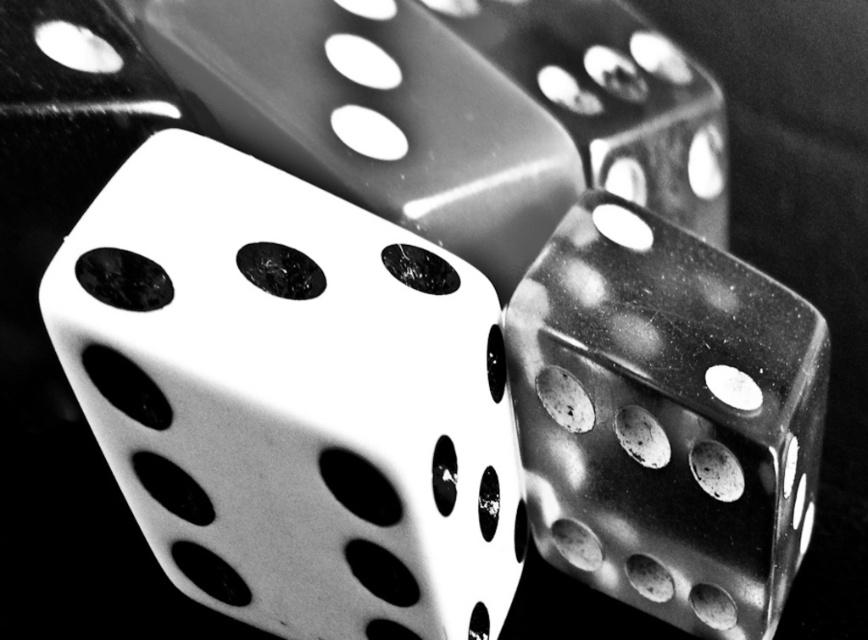
You are arranging dice for a game and have two dice in front of you, the white matte dice at center and the metallic dice at center. Which one is more to the left?

The white matte dice at center is positioned on the left side of metallic dice at center, so it is more to the left.

Consider the image. What object is located at the coordinates point (375,116) in the image?

The point (375,116) indicates the white glossy dice at center.

You are analyzing the arrangement of dice in a black and white image. The scene shows three dice with a white matte dice at center. Based on their positions, which die is positioned closer to the bottom edge of the image?

The white matte dice at center is located at point (293,397), which means it is closer to the bottom edge of the image compared to the other dice.